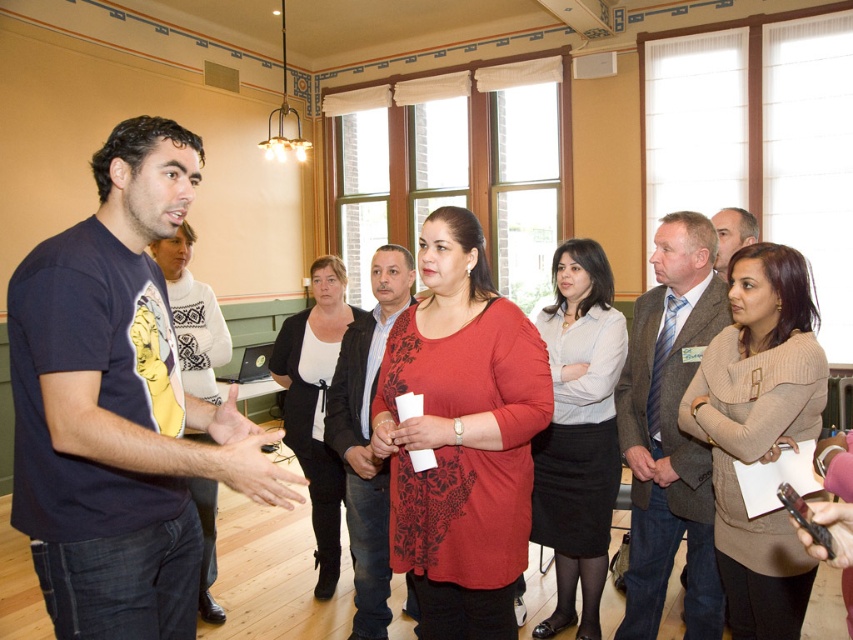
Is matte red blouse at center behind matte black t-shirt at center?

No, it is in front of matte black t-shirt at center.

Is matte red blouse at center to the left of matte black t-shirt at center from the viewer's perspective?

Incorrect, matte red blouse at center is not on the left side of matte black t-shirt at center.

Image resolution: width=853 pixels, height=640 pixels. I want to click on matte red blouse at center, so click(x=461, y=435).

Who is more forward, (384, 595) or (747, 237)?

Point (384, 595)

Between matte black shirt at center and matte gray suit at center, which one is positioned higher?

Positioned higher is matte gray suit at center.

Does point (366, 481) come closer to viewer compared to point (740, 234)?

Yes, point (366, 481) is in front of point (740, 234).

The width and height of the screenshot is (853, 640). Identify the location of matte black shirt at center. (367, 438).

This screenshot has height=640, width=853. In order to click on dark blue t-shirt at center in this screenshot , I will do `click(119, 406)`.

Does point (128, 552) come closer to viewer compared to point (712, 220)?

Yes, point (128, 552) is closer to viewer.

Identify the location of dark blue t-shirt at center. Image resolution: width=853 pixels, height=640 pixels. 119,406.